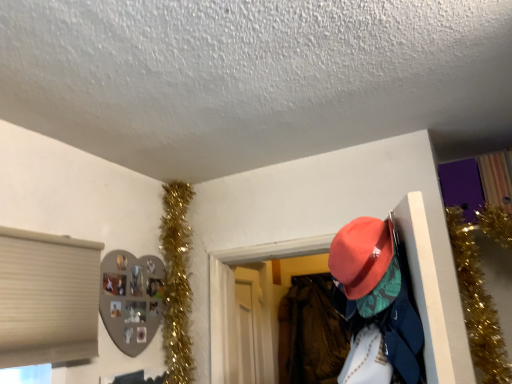
Question: From the image's perspective, is velvet-like orange hat at center-right over matte orange hat at upper right?

Choices:
 (A) yes
 (B) no

Answer: (B)

Question: Is velvet-like orange hat at center-right not within matte orange hat at upper right?

Choices:
 (A) yes
 (B) no

Answer: (A)

Question: From the image's perspective, does velvet-like orange hat at center-right appear lower than matte orange hat at upper right?

Choices:
 (A) yes
 (B) no

Answer: (A)

Question: Can you confirm if velvet-like orange hat at center-right is shorter than matte orange hat at upper right?

Choices:
 (A) yes
 (B) no

Answer: (B)

Question: Is the depth of velvet-like orange hat at center-right greater than that of matte orange hat at upper right?

Choices:
 (A) no
 (B) yes

Answer: (B)

Question: Is velvet-like orange hat at center-right beside matte orange hat at upper right?

Choices:
 (A) yes
 (B) no

Answer: (B)

Question: Is gold tinsel garland at upper left to the right of matte orange hat at upper right from the viewer's perspective?

Choices:
 (A) yes
 (B) no

Answer: (B)

Question: From a real-world perspective, is gold tinsel garland at upper left located beneath matte orange hat at upper right?

Choices:
 (A) no
 (B) yes

Answer: (A)

Question: Is gold tinsel garland at upper left facing away from matte orange hat at upper right?

Choices:
 (A) yes
 (B) no

Answer: (B)

Question: Is gold tinsel garland at upper left taller than matte orange hat at upper right?

Choices:
 (A) no
 (B) yes

Answer: (B)

Question: Would you say gold tinsel garland at upper left contains matte orange hat at upper right?

Choices:
 (A) no
 (B) yes

Answer: (A)

Question: Is gold tinsel garland at upper left to the left of matte orange hat at upper right from the viewer's perspective?

Choices:
 (A) yes
 (B) no

Answer: (A)

Question: Would you say velvet-like orange hat at center-right contains gold tinsel garland at upper left?

Choices:
 (A) no
 (B) yes

Answer: (A)